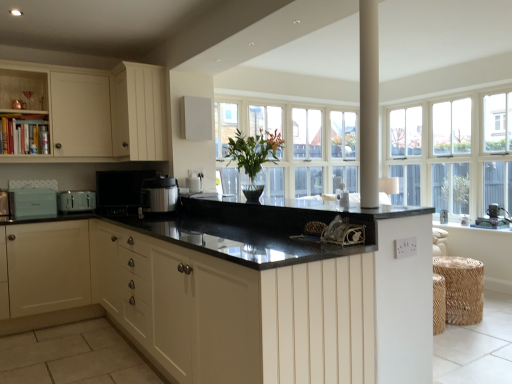
Question: From the image's perspective, is white matte speaker at upper center, acting as the 1th appliance starting from the right, positioned above or below woven straw stool at lower right?

Choices:
 (A) above
 (B) below

Answer: (A)

Question: Does point (207, 99) appear closer or farther from the camera than point (456, 291)?

Choices:
 (A) farther
 (B) closer

Answer: (A)

Question: Estimate the real-world distances between objects in this image. Which object is farther from the teal matte toaster at left, which is the fifth appliance from right to left?

Choices:
 (A) matte black pressure cooker at center, which is counted as the fourth appliance, starting from the left
 (B) white wood cabinet at upper left
 (C) white textured window sill at right
 (D) green glossy vase at center
 (E) black matte microwave at center, arranged as the third appliance when viewed from the right

Answer: (C)

Question: Which is farther from the black granite countertop at center, which appears as the 2th countertop when ordered from the bottom?

Choices:
 (A) white textured window sill at right
 (B) matte black pressure cooker at center, which is counted as the fourth appliance, starting from the left
 (C) matte silver toaster at left, which is the 2th appliance in left-to-right order
 (D) woven straw stool at lower right
 (E) white matte speaker at upper center, acting as the 1th appliance starting from the right

Answer: (A)